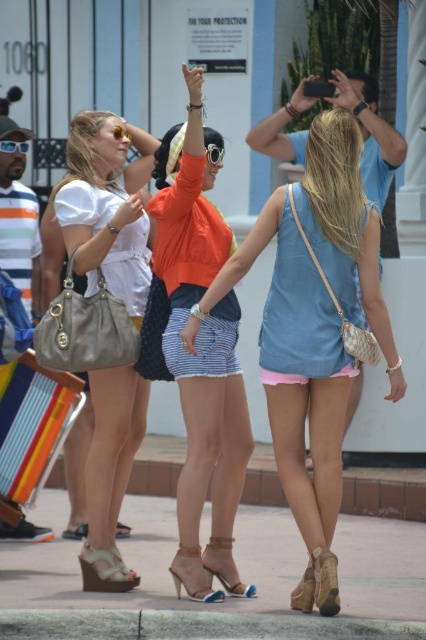
From the picture: You are a delivery person who needs to place a small package between the matte white purse at left and the leather wedge sandal at lower center. The package requires 1 meter of space. Can you fit it there?

The distance between the matte white purse at left and the leather wedge sandal at lower center is 8.06 meters, so yes, the package requiring 1 meter of space can easily be placed between them.

You are standing at the camera position and want to take a photo of the point at coordinates point (x=112, y=392). Considering the distance, will you need to use a zoom lens to capture it clearly?

The point (x=112, y=392) is 34.79 meters away from the camera. A zoom lens is necessary to capture it clearly at that distance.